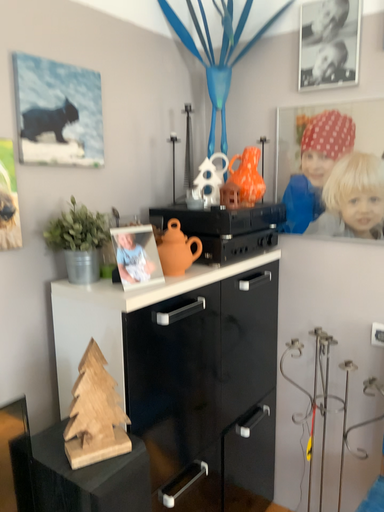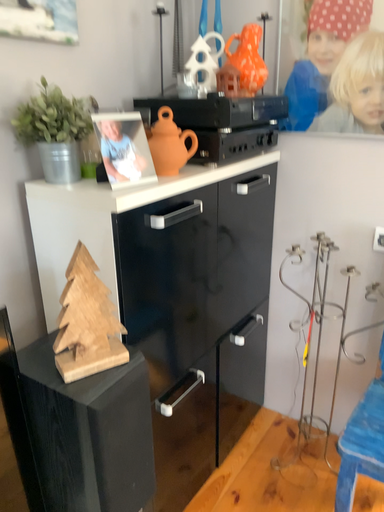
Question: How did the camera likely rotate when shooting the video?

Choices:
 (A) rotated downward
 (B) rotated upward

Answer: (A)